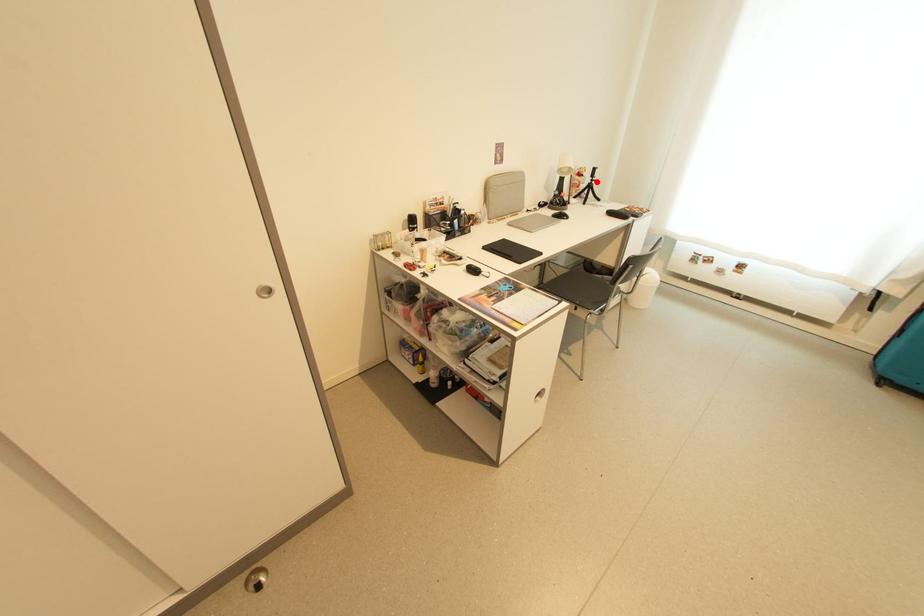
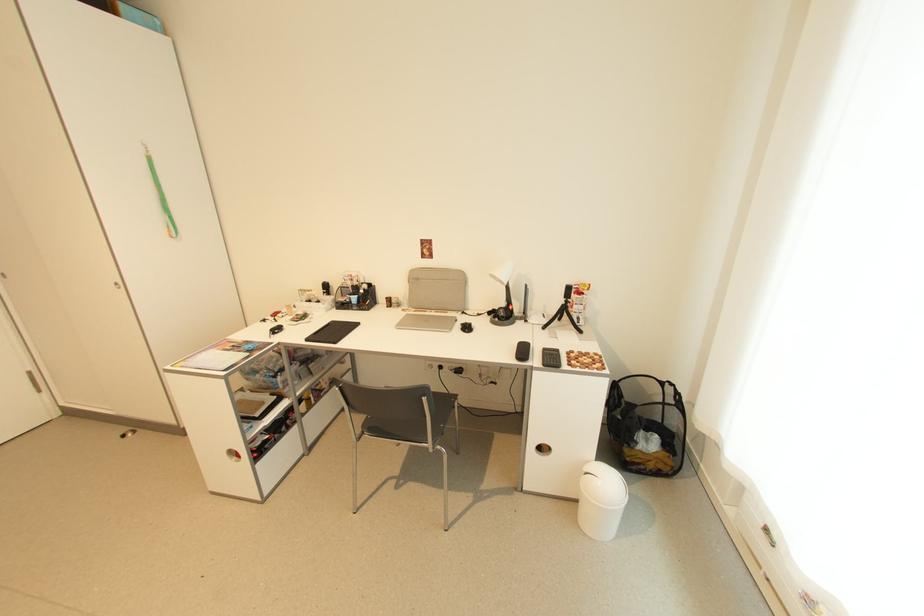
Question: I am providing you with two images of the same scene from different viewpoints. Image1 has a red point marked. In image2, the corresponding 3D location appears at what relative position? Reply with the corresponding letter.

Choices:
 (A) Closer
 (B) Farther

Answer: (B)